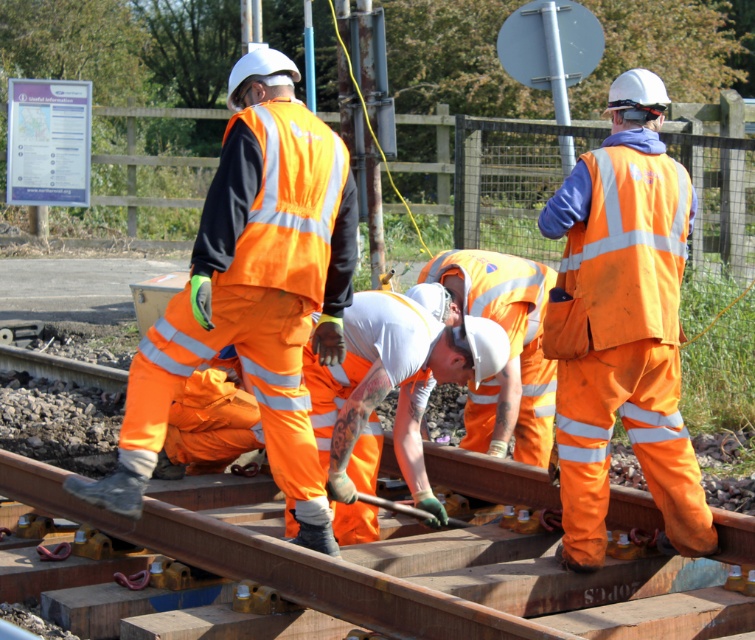
Does high-visibility orange reflective vest at center appear on the left side of high visibility orange uniform at center?

Yes, high-visibility orange reflective vest at center is to the left of high visibility orange uniform at center.

Between point (63, 484) and point (612, 289), which one is positioned behind?

Positioned behind is point (63, 484).

Identify the location of high-visibility orange reflective vest at center. Image resolution: width=755 pixels, height=640 pixels. click(x=254, y=291).

Is high-visibility orange safety vest at center above high-visibility fabric safety vest at right?

A: Yes.

Does high-visibility orange safety vest at center appear on the left side of high-visibility fabric safety vest at right?

Yes, high-visibility orange safety vest at center is to the left of high-visibility fabric safety vest at right.

Is point (236, 244) positioned behind point (658, 237)?

No, it is in front of (658, 237).

Identify the location of high-visibility orange safety vest at center. (285, 204).

Which of these two, high visibility orange uniform at center or high-visibility fabric safety vest at right, stands taller?

high visibility orange uniform at center is taller.

Between high visibility orange uniform at center and high-visibility fabric safety vest at right, which one has less height?

With less height is high-visibility fabric safety vest at right.

Find the location of a particular element. This screenshot has width=755, height=640. high visibility orange uniform at center is located at coordinates (626, 324).